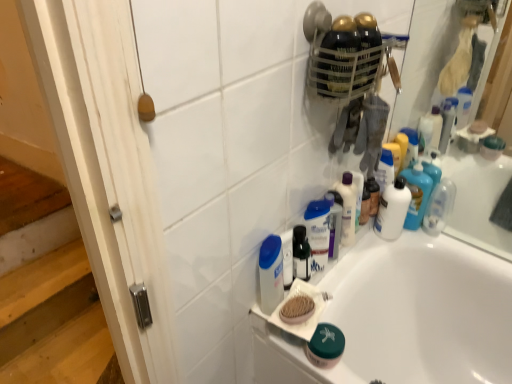
Question: Is green matte jar at lower center, which appears as the first toiletry when viewed from the left, positioned with its back to translucent plastic mouthwash at center, the 2th mouthwash when ordered from right to left?

Choices:
 (A) yes
 (B) no

Answer: (B)

Question: Can you confirm if green matte jar at lower center, which appears as the first toiletry when viewed from the left, is positioned to the right of translucent plastic mouthwash at center, arranged as the second mouthwash when viewed from the left?

Choices:
 (A) yes
 (B) no

Answer: (A)

Question: From the image's perspective, does green matte jar at lower center, which appears as the first toiletry when viewed from the left, appear higher than translucent plastic mouthwash at center, the second mouthwash when ordered from back to front?

Choices:
 (A) no
 (B) yes

Answer: (A)

Question: From a real-world perspective, is green matte jar at lower center, the fourth toiletry from the right, located higher than translucent plastic mouthwash at center, the second mouthwash positioned from the front?

Choices:
 (A) no
 (B) yes

Answer: (A)

Question: Considering the relative sizes of green matte jar at lower center, the fourth toiletry from the right, and translucent plastic mouthwash at center, arranged as the second mouthwash when viewed from the left, in the image provided, is green matte jar at lower center, the fourth toiletry from the right, taller than translucent plastic mouthwash at center, arranged as the second mouthwash when viewed from the left,?

Choices:
 (A) no
 (B) yes

Answer: (A)

Question: Is green matte jar at lower center, the fourth toiletry from the right, surrounding translucent plastic mouthwash at center, arranged as the second mouthwash when viewed from the left?

Choices:
 (A) no
 (B) yes

Answer: (A)

Question: Is white glossy bathtub at lower center far away from green matte jar at lower center, the fourth toiletry from the right?

Choices:
 (A) yes
 (B) no

Answer: (B)

Question: Can you confirm if white glossy bathtub at lower center is thinner than green matte jar at lower center, the fourth toiletry from the right?

Choices:
 (A) yes
 (B) no

Answer: (B)

Question: Is white glossy bathtub at lower center outside green matte jar at lower center, the fourth toiletry from the right?

Choices:
 (A) no
 (B) yes

Answer: (B)

Question: Is green matte jar at lower center, the fourth toiletry from the right, a part of white glossy bathtub at lower center?

Choices:
 (A) yes
 (B) no

Answer: (B)

Question: Is white glossy bathtub at lower center closer to the viewer compared to green matte jar at lower center, which appears as the first toiletry when viewed from the left?

Choices:
 (A) no
 (B) yes

Answer: (B)

Question: Considering the relative positions of white glossy bathtub at lower center and green matte jar at lower center, which appears as the first toiletry when viewed from the left, in the image provided, is white glossy bathtub at lower center to the left of green matte jar at lower center, which appears as the first toiletry when viewed from the left, from the viewer's perspective?

Choices:
 (A) yes
 (B) no

Answer: (B)

Question: Is clear plastic bottle at upper right, which is counted as the first toiletry, starting from the right, looking in the opposite direction of translucent plastic mouthwash at center, the second mouthwash when ordered from back to front?

Choices:
 (A) yes
 (B) no

Answer: (B)